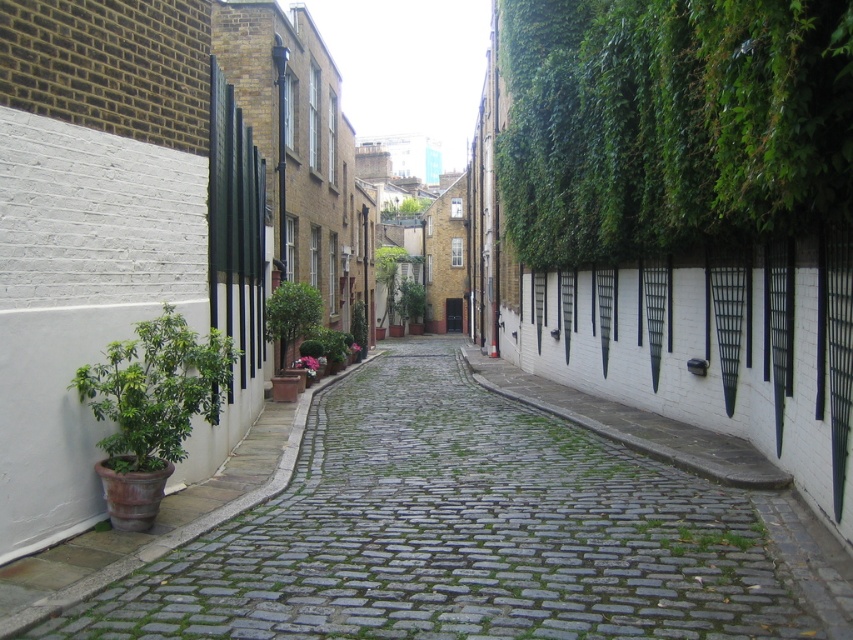
You are standing in the narrow cobblestone alleyway between the white walls on the left and ivy covered walls on the right. There is a point marked at coordinates (476, 538). Based on the scene description, what is the significance of this point?

The point at coordinates (476, 538) represents the location of the green mossy cobblestone alley at lower left.

You are a gardener who needs to trim plants in the alleyway. You see the green grass at center and the green leafy plant at center. Which one requires trimming first if you prioritize taller plants?

The green leafy plant at center requires trimming first because it is taller than the green grass at center.

You are a delivery person carrying a box and need to step from the green mossy cobblestone alley at lower left to the green grass at center. Considering their heights, which surface will you need to step down onto?

The green mossy cobblestone alley at lower left is taller than the green grass at center, so you will need to step down onto the green grass at center.